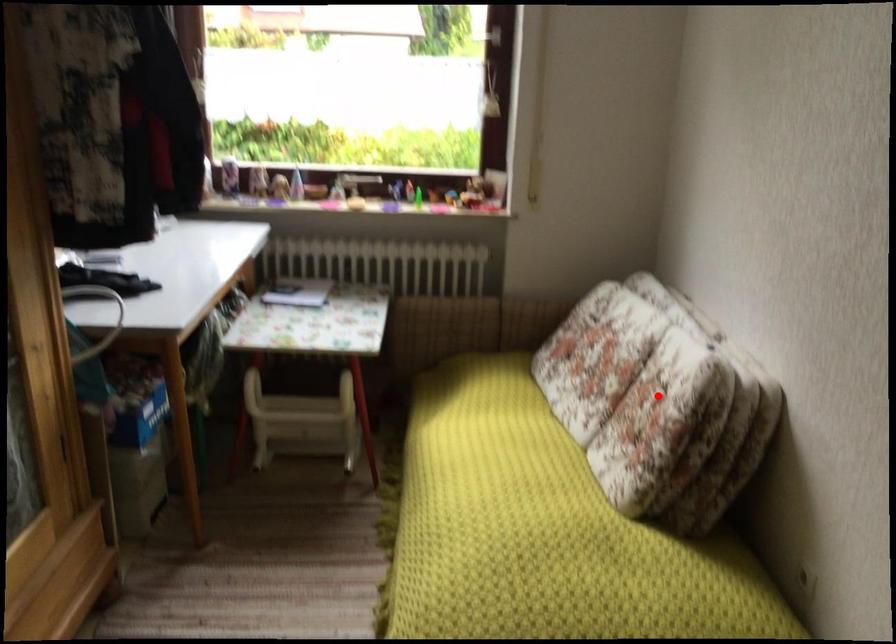
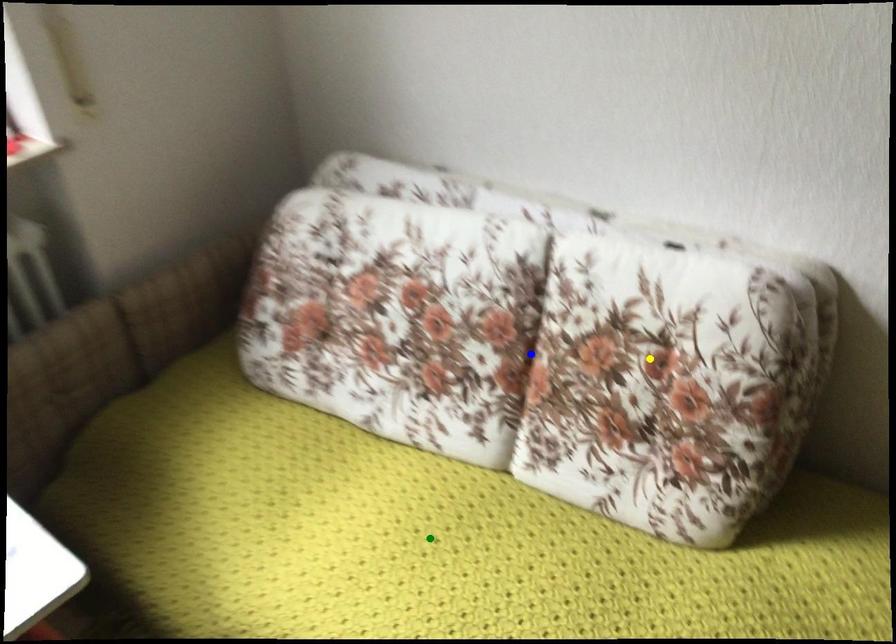
Question: I am providing you with two images of the same scene from different viewpoints. A red point is marked on the first image. You are given multiple points on the second image. Which point in image 2 represents the same 3d spot as the red point in image 1?

Choices:
 (A) green point
 (B) blue point
 (C) yellow point

Answer: (C)